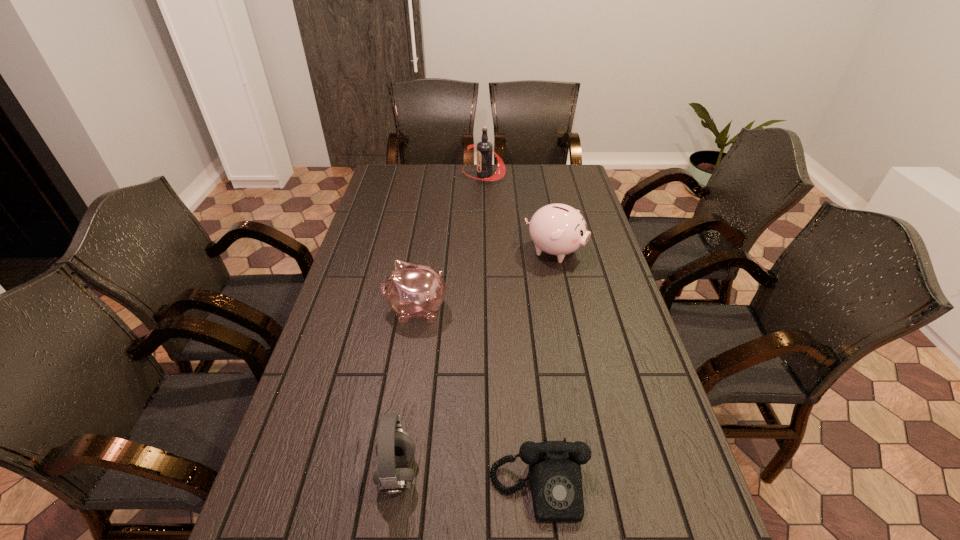
This screenshot has height=540, width=960. In the image, there is a desktop. In order to click on vacant space at the far left corner in this screenshot , I will do `click(411, 172)`.

Find the location of `free region at the far right corner of the desktop`. free region at the far right corner of the desktop is located at coordinates (581, 184).

This screenshot has width=960, height=540. Find the location of `vacant area that lies between the nearer piggy bank and the headset`. vacant area that lies between the nearer piggy bank and the headset is located at coordinates (407, 392).

This screenshot has width=960, height=540. I want to click on unoccupied position between the shortest object and the right piggy bank, so click(547, 370).

Find the location of a particular element. The height and width of the screenshot is (540, 960). unoccupied area between the farthest object and the second farthest object is located at coordinates [x=519, y=213].

Find the location of a particular element. This screenshot has height=540, width=960. vacant region between the right piggy bank and the left piggy bank is located at coordinates (486, 280).

Find the location of a particular element. free space between the tallest object and the headset is located at coordinates (441, 324).

You are a GUI agent. You are given a task and a screenshot of the screen. Output one action in this format:
    pyautogui.click(x=<x>, y=<y>)
    Task: Click on the vacant area between the farthest object and the shortest object
    
    Given the screenshot: What is the action you would take?
    512,332

Identify the location of free space between the farther piggy bank and the tallest object. (519, 213).

The image size is (960, 540). What are the coordinates of `vacant space that is in between the telephone and the nearer piggy bank` in the screenshot? It's located at (478, 399).